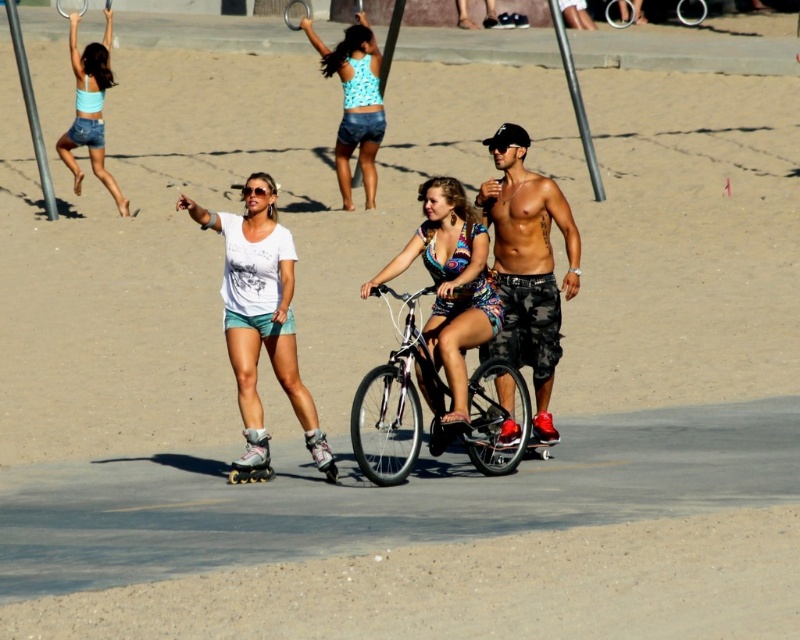
Question: Among these objects, which one is nearest to the camera?

Choices:
 (A) silver metallic roller skate at center
 (B) camouflage shorts at center
 (C) multicolored fabric dress at center
 (D) white matte t-shirt at center

Answer: (D)

Question: Which object is the farthest from the blue printed tank top at center?

Choices:
 (A) camouflage shorts at center
 (B) multicolored fabric dress at center

Answer: (B)

Question: Which point is closer to the camera taking this photo?

Choices:
 (A) (541, 456)
 (B) (462, 232)
 (C) (544, 406)
 (D) (320, 436)

Answer: (B)

Question: Is denim shorts at upper left positioned behind black rubber skateboard at center?

Choices:
 (A) yes
 (B) no

Answer: (A)

Question: Can you confirm if blue printed tank top at center is wider than silver metallic roller skate at center?

Choices:
 (A) yes
 (B) no

Answer: (A)

Question: Can you confirm if blue printed tank top at center is bigger than black rubber skateboard at center?

Choices:
 (A) no
 (B) yes

Answer: (B)